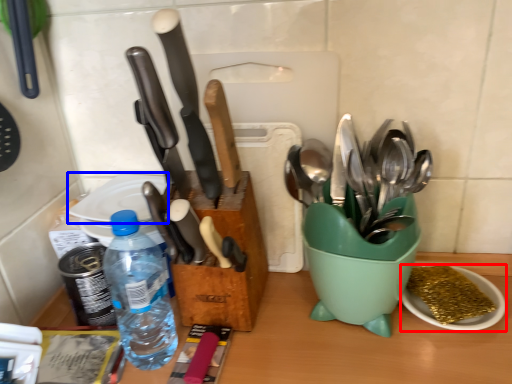
Question: Which object is further to the camera taking this photo, tableware (highlighted by a red box) or plate (highlighted by a blue box)?

Choices:
 (A) tableware
 (B) plate

Answer: (B)